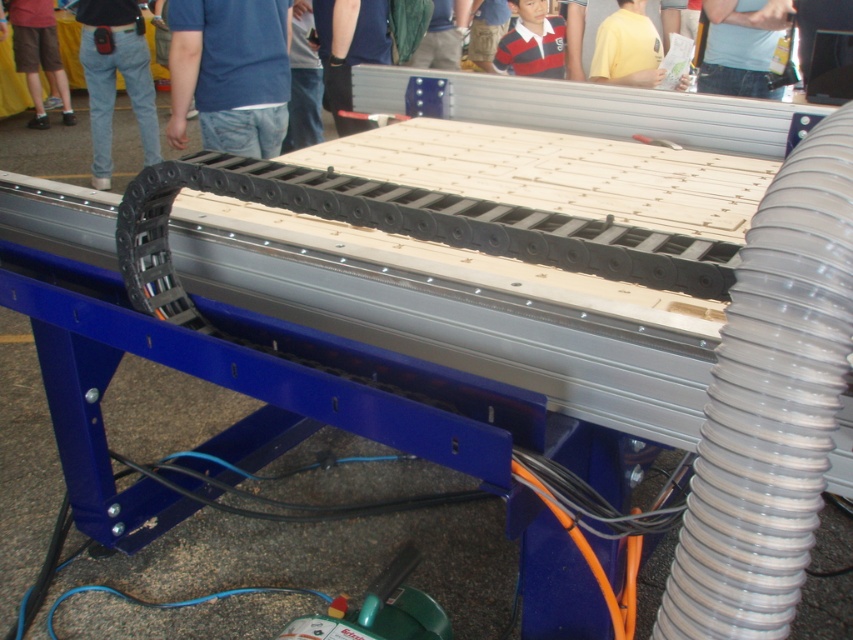
Who is more forward, (245, 22) or (788, 22)?

Point (245, 22) is more forward.

Is point (230, 125) less distant than point (740, 72)?

That is True.

Identify the location of blue denim shorts at center. This screenshot has width=853, height=640. [x=230, y=72].

Looking at this image, who is higher up, brown cotton shorts at lower left or striped polo shirt at upper center?

brown cotton shorts at lower left

Is brown cotton shorts at lower left smaller than striped polo shirt at upper center?

No.

Find the location of a particular element. The width and height of the screenshot is (853, 640). brown cotton shorts at lower left is located at coordinates (38, 52).

At what (x,y) coordinates should I click in order to perform the action: click on brown cotton shorts at lower left. Please return your answer as a coordinate pair (x, y). This screenshot has width=853, height=640. Looking at the image, I should click on [x=38, y=52].

Is blue denim shorts at center positioned in front of denim jeans at left?

Yes, blue denim shorts at center is in front of denim jeans at left.

Which is below, blue denim shorts at center or denim jeans at left?

blue denim shorts at center is lower down.

Where is `blue denim shorts at center`? blue denim shorts at center is located at coordinates (230, 72).

The height and width of the screenshot is (640, 853). Identify the location of blue denim shorts at center. (230, 72).